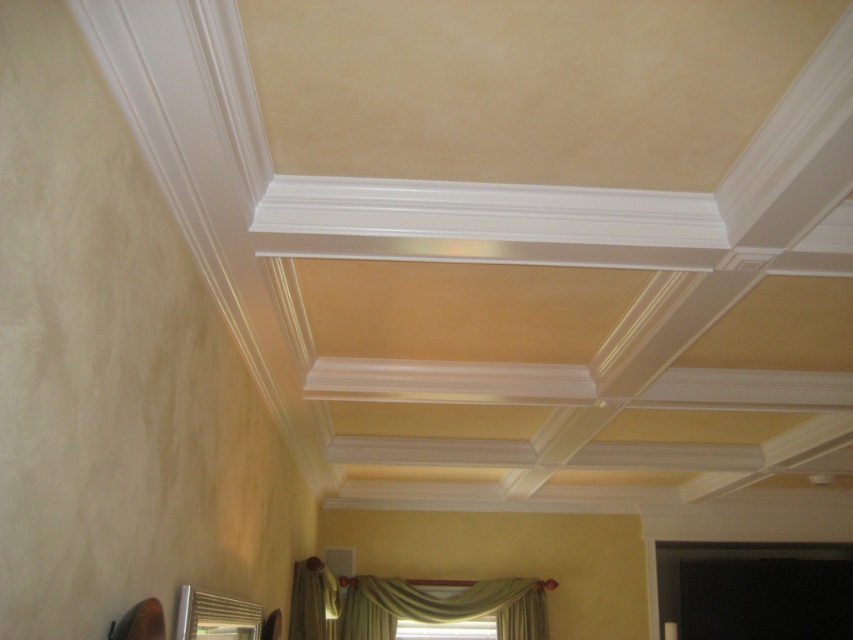
Is point (505, 589) positioned after point (334, 612)?

Yes, point (505, 589) is behind point (334, 612).

Between point (527, 593) and point (300, 593), which one is positioned behind?

Positioned behind is point (527, 593).

From the picture: Measure the distance between point (491, 604) and camera.

5.03 meters

The width and height of the screenshot is (853, 640). I want to click on green fabric curtain at lower center, so click(x=444, y=605).